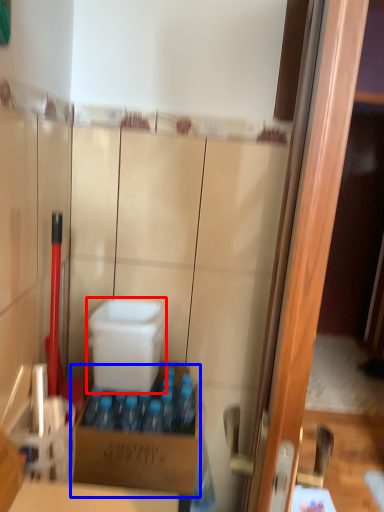
Question: Among these objects, which one is nearest to the camera, box (highlighted by a red box) or box (highlighted by a blue box)?

Choices:
 (A) box
 (B) box

Answer: (B)